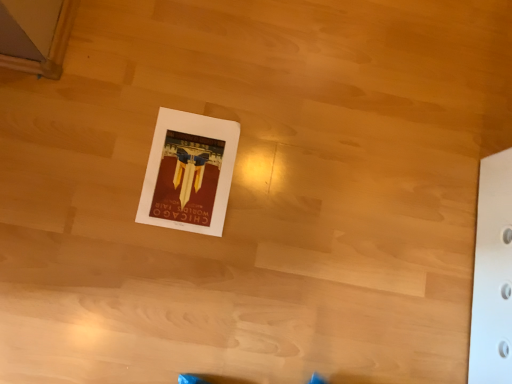
The image size is (512, 384). In order to click on matte white picture frame at center in this screenshot , I will do `click(189, 172)`.

The height and width of the screenshot is (384, 512). Describe the element at coordinates (189, 172) in the screenshot. I see `matte white picture frame at center` at that location.

At what (x,y) coordinates should I click in order to perform the action: click on matte white picture frame at center. Please return your answer as a coordinate pair (x, y). The height and width of the screenshot is (384, 512). Looking at the image, I should click on (189, 172).